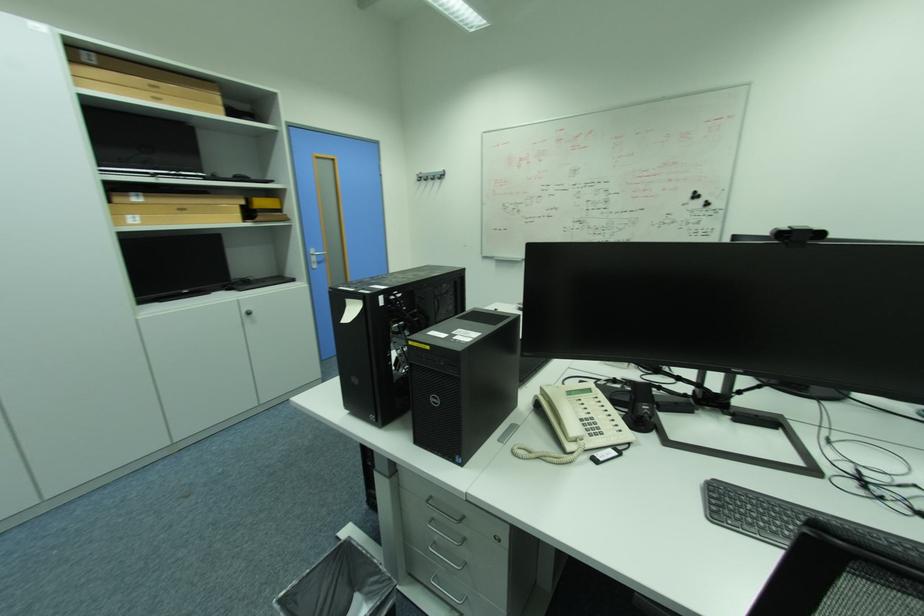
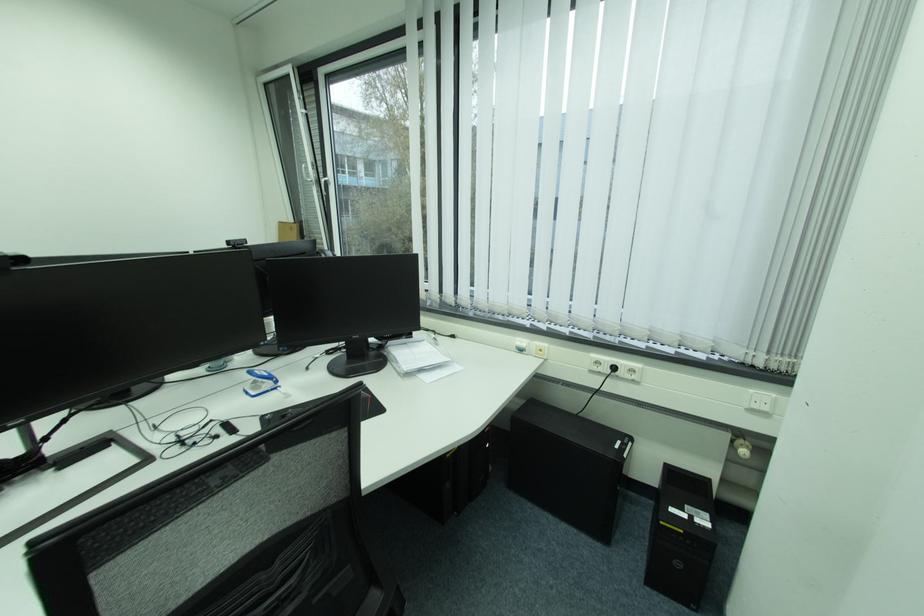
The point at (x=829, y=233) is marked in the first image. Where is the corresponding point in the second image?

(29, 261)